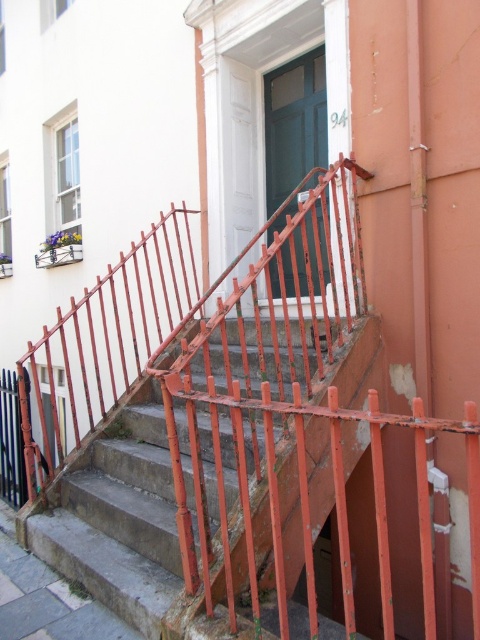
Question: Is rusty metal railing at center behind green glossy door at center?

Choices:
 (A) no
 (B) yes

Answer: (A)

Question: Among these points, which one is nearest to the camera?

Choices:
 (A) (269, 92)
 (B) (179, 600)

Answer: (B)

Question: Where is rusty metal railing at center located in relation to green glossy door at center in the image?

Choices:
 (A) left
 (B) right

Answer: (A)

Question: Which point is closer to the camera?

Choices:
 (A) (291, 179)
 (B) (255, 308)

Answer: (B)

Question: Is rusty metal railing at center closer to the viewer compared to green glossy door at center?

Choices:
 (A) no
 (B) yes

Answer: (B)